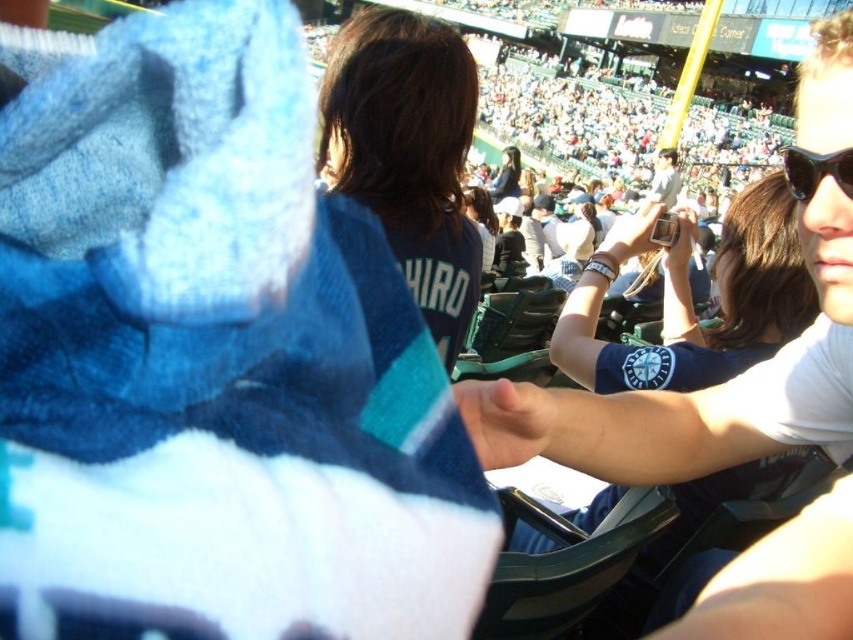
You are a photographer at the stadium and want to capture a closeup of the blue fabric wristband at center. Based on its position, where should you aim your camera?

The blue fabric wristband at center is located at the 2D coordinates point (689,300), so you should aim your camera at that specific point to capture it in focus.

You are standing at the point with coordinates point [457,180] and want to walk towards the point with coordinates point [477,224]. Will you be moving forward or backward relative to your current position?

Since point [457,180] is in front of point [477,224], moving towards point [477,224] would mean moving backward relative to your current position.

You are standing at the point labeled point [675,180] and want to move to the point labeled point [785,465]. Which direction should you move to get closer to the camera?

To move from point [675,180] to point [785,465], you should move towards the right and upwards since point [785,465] is closer to the camera than point [675,180].